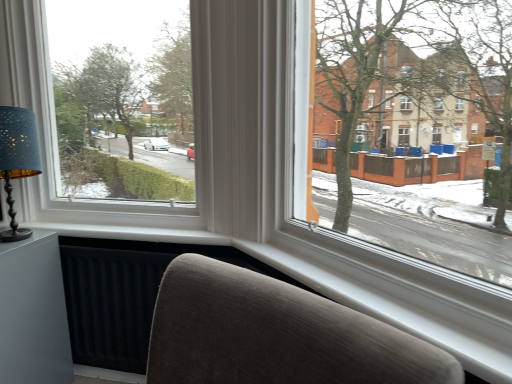
Image resolution: width=512 pixels, height=384 pixels. What do you see at coordinates (17, 159) in the screenshot?
I see `matte blue lampshade at left` at bounding box center [17, 159].

Locate an element on the screen. Image resolution: width=512 pixels, height=384 pixels. white plastic window at upper left is located at coordinates (58, 159).

In order to face white plastic window at upper left, should I rotate leftwards or rightwards?

A 17.232 degree turn to the left will do.

What are the coordinates of `matte blue lampshade at left` in the screenshot? It's located at (17, 159).

In terms of size, does white plastic window at upper left appear bigger or smaller than matte gray table at lower left?

Considering their sizes, white plastic window at upper left takes up more space than matte gray table at lower left.

Is white plastic window at upper left facing towards matte gray table at lower left?

No.

Would you say white plastic window at upper left is to the left or to the right of matte gray table at lower left in the picture?

From the image, it's evident that white plastic window at upper left is to the right of matte gray table at lower left.

In the image, is white plastic window at upper left positioned in front of or behind matte gray table at lower left?

Visually, white plastic window at upper left is located in front of matte gray table at lower left.

Is matte blue lampshade at left not within matte gray table at lower left?

matte blue lampshade at left is positioned outside matte gray table at lower left.

Which is behind, matte blue lampshade at left or matte gray table at lower left?

matte gray table at lower left is more distant.

Is matte blue lampshade at left looking in the opposite direction of matte gray table at lower left?

matte blue lampshade at left is not turned away from matte gray table at lower left.

Is matte blue lampshade at left positioned far away from matte gray table at lower left?

matte blue lampshade at left is actually quite close to matte gray table at lower left.

How much distance is there between matte gray table at lower left and white plastic window at upper left?

16.50 inches.

Is point (9, 379) closer or farther from the camera than point (38, 93)?

Point (9, 379) is closer to the camera than point (38, 93).

Can white plastic window at upper left be found inside matte gray table at lower left?

No, white plastic window at upper left is not a part of matte gray table at lower left.

Can you tell me how much matte blue lampshade at left and white plastic window at upper left differ in facing direction?

There is a 9.28-degree angle between the facing directions of matte blue lampshade at left and white plastic window at upper left.

From a real-world perspective, between matte blue lampshade at left and white plastic window at upper left, who is vertically higher?

white plastic window at upper left.

Which of these two, matte blue lampshade at left or white plastic window at upper left, is thinner?

With smaller width is matte blue lampshade at left.

Which is more to the right, matte blue lampshade at left or white plastic window at upper left?

Positioned to the right is white plastic window at upper left.

Which of these two, white plastic window at upper left or matte blue lampshade at left, is bigger?

Bigger between the two is white plastic window at upper left.

Between white plastic window at upper left and matte blue lampshade at left, which one has more height?

With more height is white plastic window at upper left.

Is matte gray table at lower left positioned with its back to matte blue lampshade at left?

matte gray table at lower left does not have its back to matte blue lampshade at left.

Is matte gray table at lower left next to matte blue lampshade at left?

No, matte gray table at lower left is not in contact with matte blue lampshade at left.

Looking at the image, does matte gray table at lower left seem bigger or smaller compared to matte blue lampshade at left?

Clearly, matte gray table at lower left is larger in size than matte blue lampshade at left.

How far apart are matte gray table at lower left and matte blue lampshade at left?

The distance of matte gray table at lower left from matte blue lampshade at left is 31.72 centimeters.

Find the location of a particular element. table that appears behind the white plastic window at upper left is located at coordinates (33, 312).

Identify the location of table directly beneath the matte blue lampshade at left (from a real-world perspective). The width and height of the screenshot is (512, 384). (33, 312).

Looking at this image, looking at the image, which one is located closer to white plastic window at upper left, matte blue lampshade at left or matte gray table at lower left?

matte blue lampshade at left lies closer to white plastic window at upper left than the other object.

When comparing their distances from matte gray table at lower left, does matte blue lampshade at left or white plastic window at upper left seem closer?

matte blue lampshade at left.

Looking at the image, which one is located closer to matte blue lampshade at left, matte gray table at lower left or white plastic window at upper left?

white plastic window at upper left is closer to matte blue lampshade at left.

From the image, which object appears to be farther from matte blue lampshade at left, white plastic window at upper left or matte gray table at lower left?

The object further to matte blue lampshade at left is matte gray table at lower left.

From the picture: When comparing their distances from matte gray table at lower left, does white plastic window at upper left or matte blue lampshade at left seem further?

Based on the image, white plastic window at upper left appears to be further to matte gray table at lower left.

Which object lies nearer to the anchor point white plastic window at upper left, matte gray table at lower left or matte blue lampshade at left?

matte blue lampshade at left.

The image size is (512, 384). In order to click on table lamp between white plastic window at upper left and matte gray table at lower left in the up-down direction in this screenshot , I will do `click(17, 159)`.